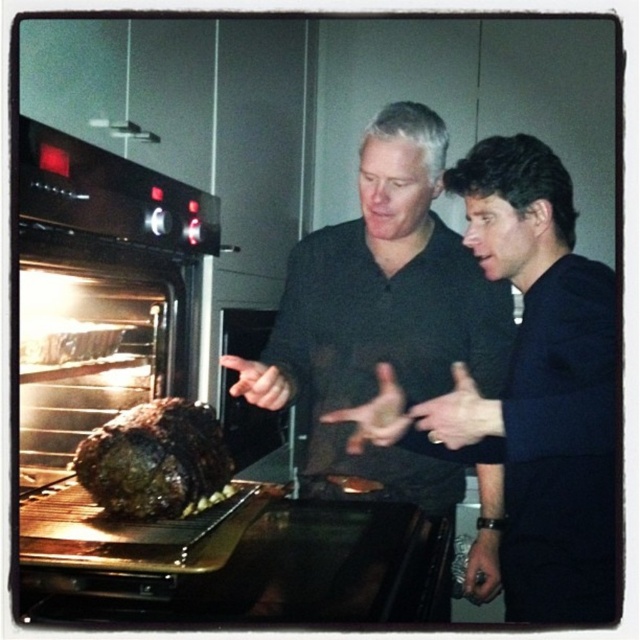
Question: Which point is closer to the camera?

Choices:
 (A) dark blue shirt at center
 (B) black glass oven at left
 (C) brown crispy turkey at center
 (D) dark gray sweater at center

Answer: (B)

Question: Considering the real-world distances, which object is farthest from the black glass oven at left?

Choices:
 (A) brown crispy turkey at center
 (B) dark blue shirt at center
 (C) dark gray sweater at center

Answer: (B)

Question: Is dark gray sweater at center thinner than brown crispy turkey at center?

Choices:
 (A) no
 (B) yes

Answer: (A)

Question: Does black glass oven at left appear under brown crispy turkey at center?

Choices:
 (A) yes
 (B) no

Answer: (B)

Question: Which object appears closest to the camera in this image?

Choices:
 (A) dark blue shirt at center
 (B) black glass oven at left

Answer: (B)

Question: Does black glass oven at left appear over dark gray sweater at center?

Choices:
 (A) yes
 (B) no

Answer: (A)